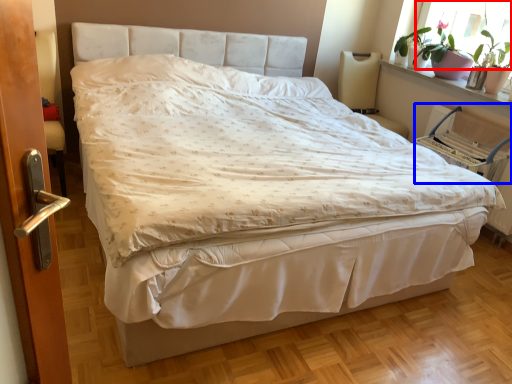
Question: Among these objects, which one is farthest to the camera, window screen (highlighted by a red box) or armchair (highlighted by a blue box)?

Choices:
 (A) window screen
 (B) armchair

Answer: (A)